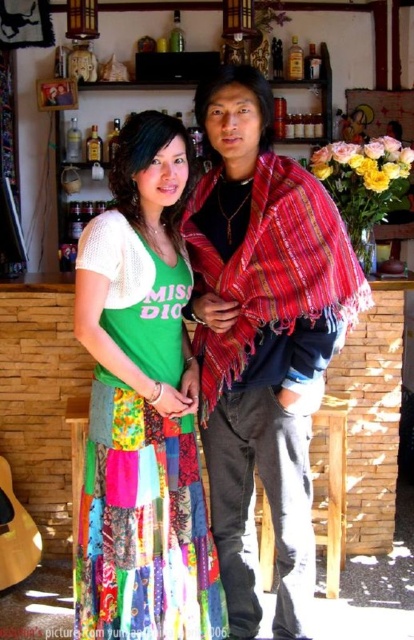
You are standing in a bar and need to reach a point marked at coordinates (115, 252). The bar counter is 5 feet away from you. Can you reach the point without moving closer to the counter?

The distance of point (115, 252) from viewer is 5.25 feet, which is slightly farther than the 5 feet distance to the bar counter. Therefore, you cannot reach the point without moving closer.

You are a fashion designer observing the scene. You notice the multicolored patchwork skirt at center and the colorful patchwork skirt at center. Which one has a greater width?

The multicolored patchwork skirt at center might be wider than colorful patchwork skirt at center according to the description.